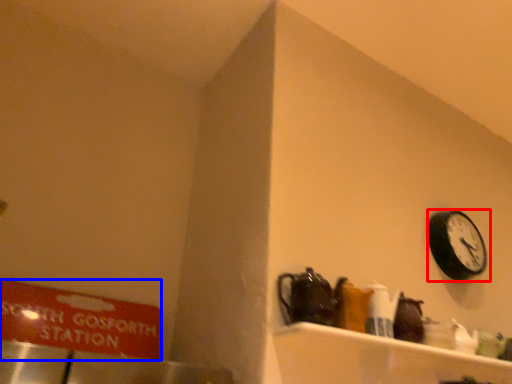
Question: Which of the following is the farthest to the observer, wall clock (highlighted by a red box) or sign (highlighted by a blue box)?

Choices:
 (A) wall clock
 (B) sign

Answer: (A)